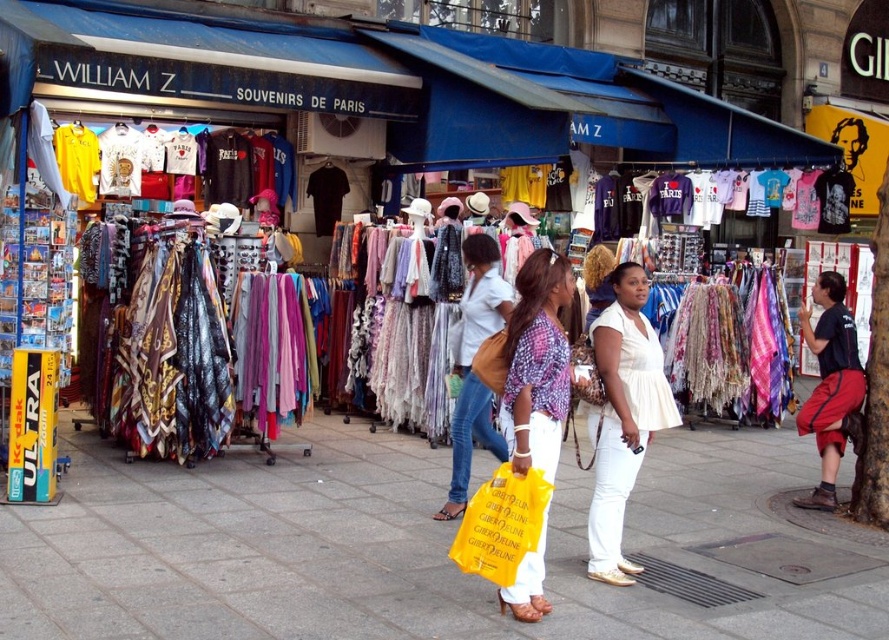
Question: Does black cotton t-shirt at right appear on the left side of matte white blouse at center?

Choices:
 (A) yes
 (B) no

Answer: (B)

Question: Can you confirm if black jersey at center is positioned to the right of matte white blouse at center?

Choices:
 (A) yes
 (B) no

Answer: (B)

Question: Among these points, which one is nearest to the camera?

Choices:
 (A) (317, 179)
 (B) (711, 442)
 (C) (610, 362)

Answer: (C)

Question: Estimate the real-world distances between objects in this image. Which object is farther from the matte white blouse at center?

Choices:
 (A) black jersey at center
 (B) smooth concrete pavement at center
 (C) matte purple blouse at center
 (D) black cotton t-shirt at right

Answer: (A)

Question: Which is nearer to the black jersey at center?

Choices:
 (A) matte brown handbag at center
 (B) matte purple blouse at center
 (C) matte white blouse at center
 (D) black cotton t-shirt at right

Answer: (A)

Question: Is white cotton blouse at center to the right of black cotton t-shirt at right from the viewer's perspective?

Choices:
 (A) no
 (B) yes

Answer: (A)